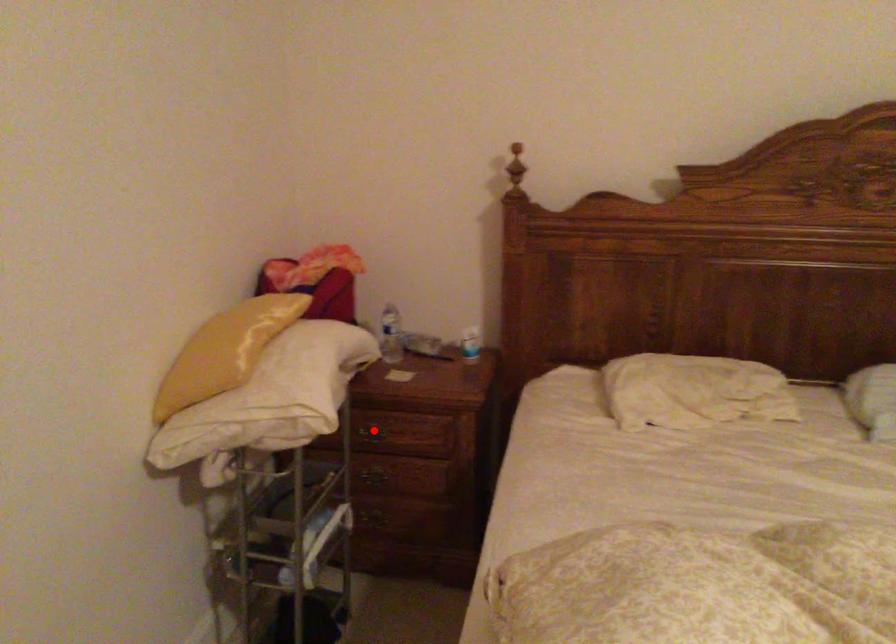
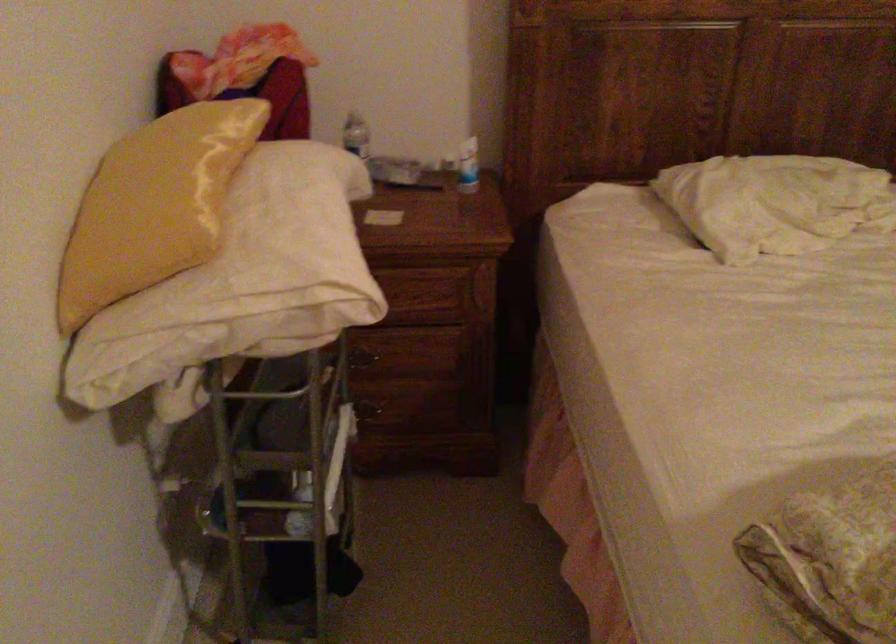
Question: I am providing you with two images of the same scene from different viewpoints. A red point is marked on the first image. Is the red point's position out of view in image 2?

Choices:
 (A) Yes
 (B) No

Answer: (A)